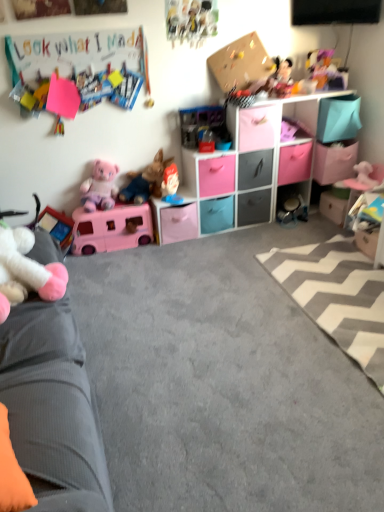
Where is `free region on the left part of white glossy drawer at lower right, the 7th drawer from the left`? free region on the left part of white glossy drawer at lower right, the 7th drawer from the left is located at coordinates (313, 224).